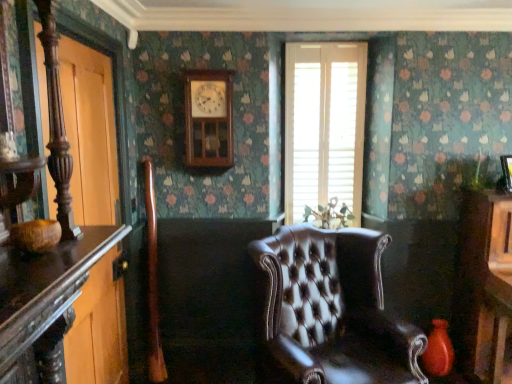
Locate an element on the screen. blank space situated above wooden clock at upper center (from a real-world perspective) is located at coordinates (206, 72).